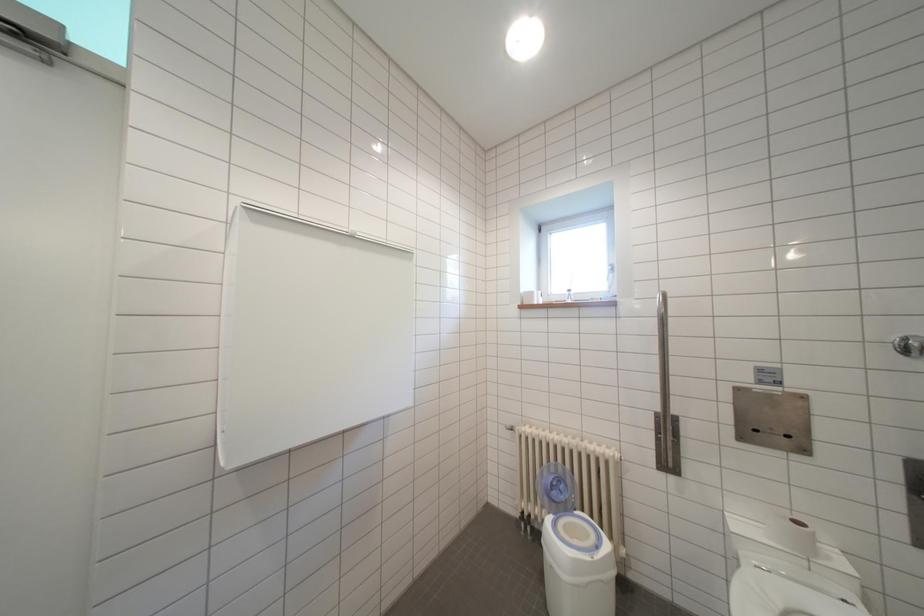
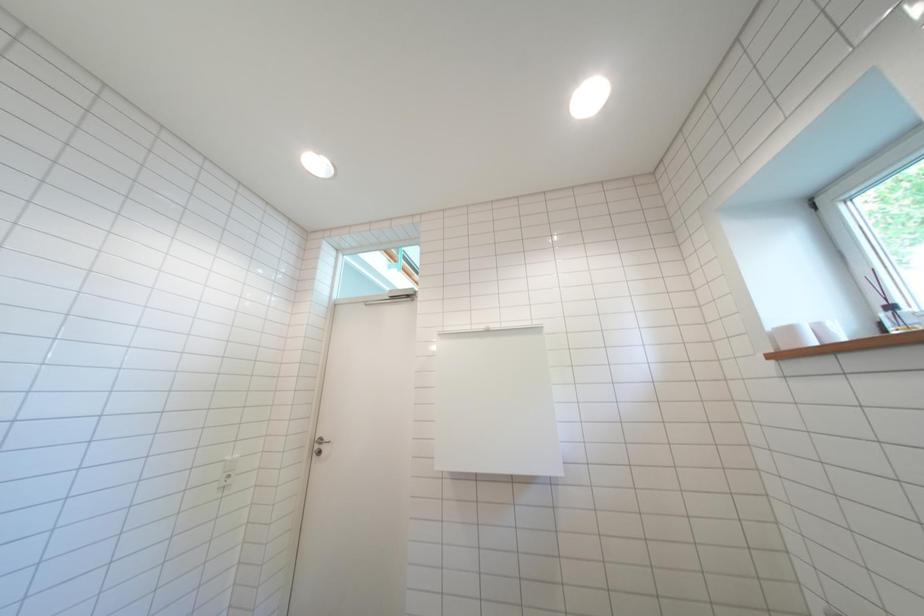
How did the camera likely rotate?

The rotation direction of the camera is left-up.